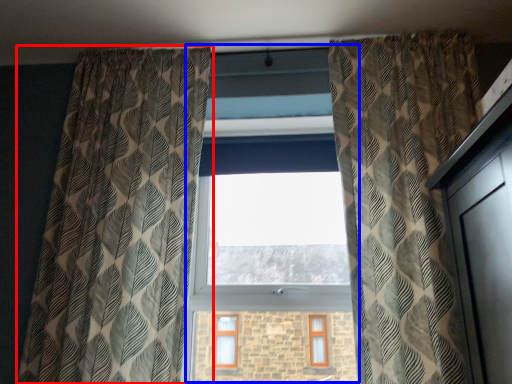
Question: Which object appears farthest to the camera in this image, curtain (highlighted by a red box) or bay window (highlighted by a blue box)?

Choices:
 (A) curtain
 (B) bay window

Answer: (B)